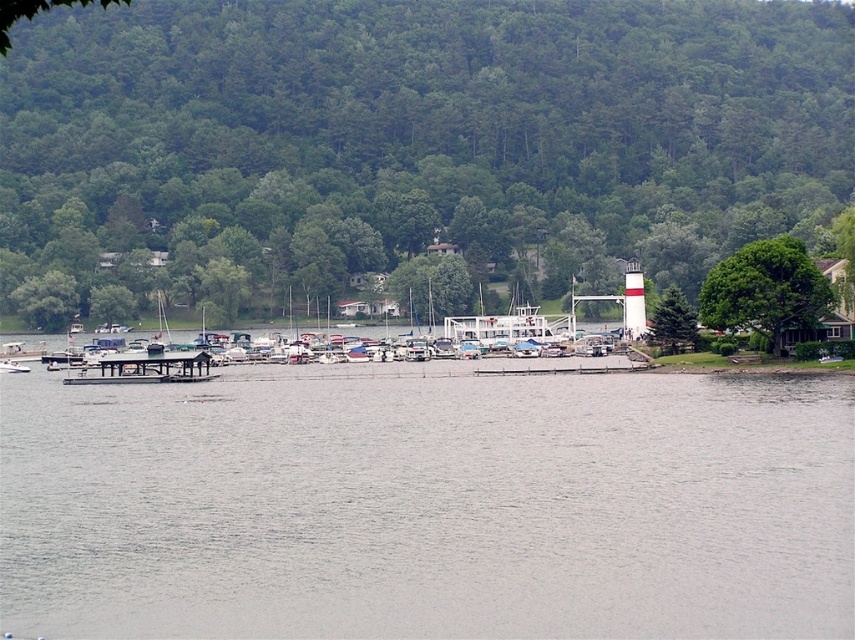
Question: Is gray water at center further to camera compared to wooden dock at center?

Choices:
 (A) yes
 (B) no

Answer: (B)

Question: Is gray water at center wider than wooden dock at center?

Choices:
 (A) no
 (B) yes

Answer: (B)

Question: Which point appears farthest from the camera in this image?

Choices:
 (A) coord(211,602)
 (B) coord(131,380)

Answer: (B)

Question: Can you confirm if gray water at center is smaller than wooden dock at center?

Choices:
 (A) yes
 (B) no

Answer: (B)

Question: Which point is farther to the camera?

Choices:
 (A) (270, 385)
 (B) (180, 355)

Answer: (B)